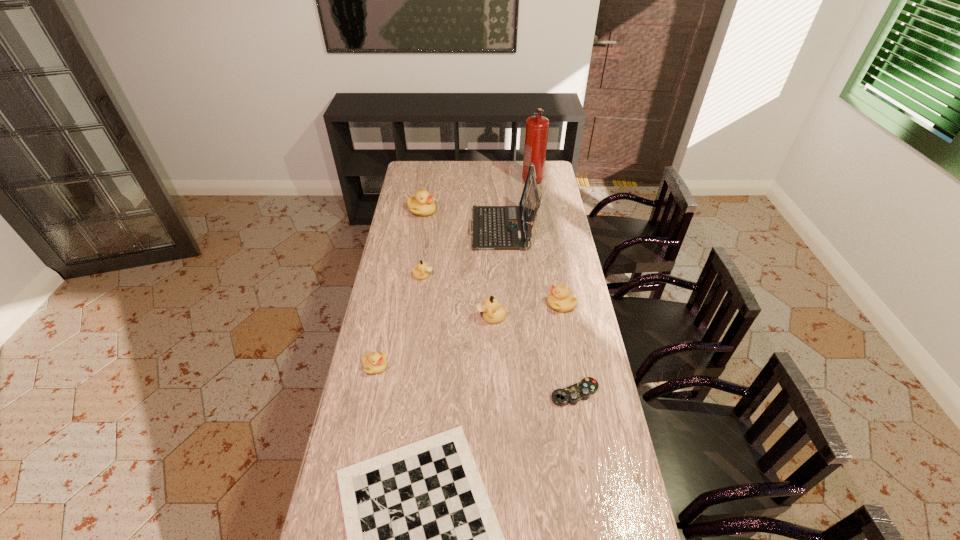
Where is `yellow duckling identified as the closest to the second tallest object`? Image resolution: width=960 pixels, height=540 pixels. yellow duckling identified as the closest to the second tallest object is located at coordinates (422, 204).

Locate an element on the screen. The width and height of the screenshot is (960, 540). free space in the image that satisfies the following two spatial constraints: 1. on the handle side the tallest object; 2. on the face of the smaller tan duckling is located at coordinates (547, 276).

At what (x,y) coordinates should I click in order to perform the action: click on blank space that satisfies the following two spatial constraints: 1. on the face of the left tan duckling; 2. on the back side of the eighth farthest object. Please return your answer as a coordinate pair (x, y). This screenshot has width=960, height=540. Looking at the image, I should click on (407, 393).

Find the location of a particular element. free point that satisfies the following two spatial constraints: 1. on the face of the eighth farthest object; 2. on the left side of the nearer tan duckling is located at coordinates (493, 393).

Find the location of `free space that satisfies the following two spatial constraints: 1. on the handle side the red fire extinguisher; 2. on the front-facing side of the farthest duckling`. free space that satisfies the following two spatial constraints: 1. on the handle side the red fire extinguisher; 2. on the front-facing side of the farthest duckling is located at coordinates (537, 211).